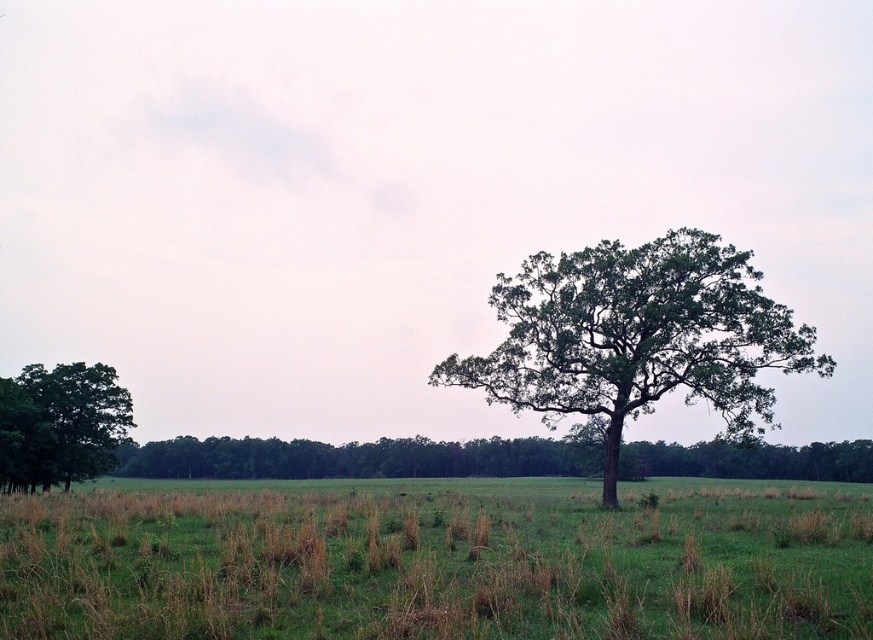
Does green grass at center have a lesser height compared to green leafy oak tree at center?

Yes.

Is green grass at center bigger than green leafy oak tree at center?

Yes, green grass at center is bigger than green leafy oak tree at center.

Is point (165, 566) more distant than point (744, 307)?

No, (165, 566) is closer to viewer.

Where is `green grass at center`? Image resolution: width=873 pixels, height=640 pixels. green grass at center is located at coordinates coord(437,560).

Is green grass at center closer to camera compared to green leafy tree at left?

Yes, it is.

Does green grass at center have a lesser height compared to green leafy tree at left?

Incorrect, green grass at center's height does not fall short of green leafy tree at left's.

Between point (377, 593) and point (102, 449), which one is positioned in front?

Point (377, 593) is more forward.

You are a GUI agent. You are given a task and a screenshot of the screen. Output one action in this format:
    pyautogui.click(x=<x>, y=<y>)
    Task: Click on the green grass at center
    The image size is (873, 640).
    Given the screenshot: What is the action you would take?
    pyautogui.click(x=437, y=560)

Which of these two, green leafy oak tree at center or green leafy tree at left, stands taller?

green leafy oak tree at center is taller.

Measure the distance from green leafy oak tree at center to green leafy tree at left.

green leafy oak tree at center and green leafy tree at left are 43.47 meters apart.

Does point (617, 413) come farther from viewer compared to point (31, 470)?

No, it is not.

Find the location of `green leafy oak tree at center`. green leafy oak tree at center is located at coordinates (637, 337).